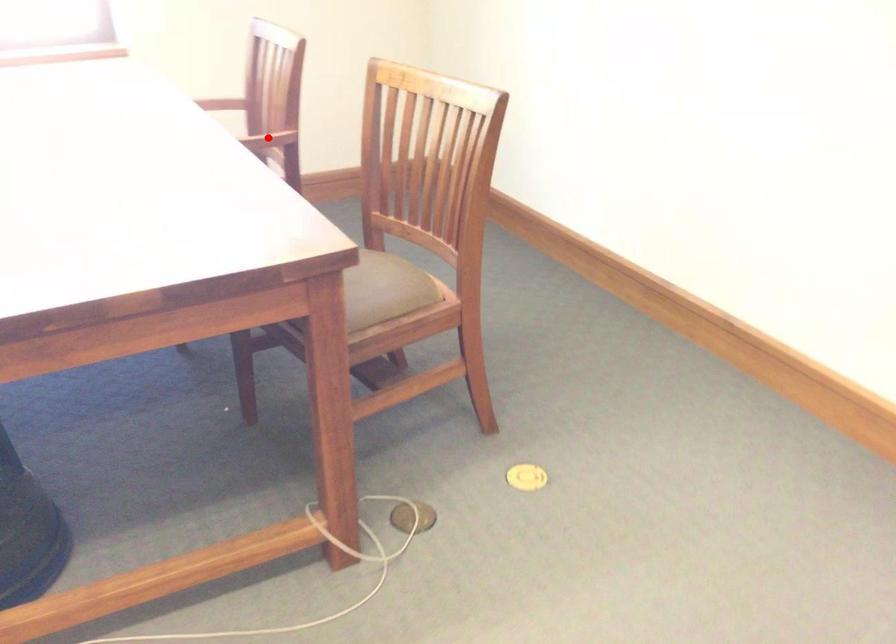
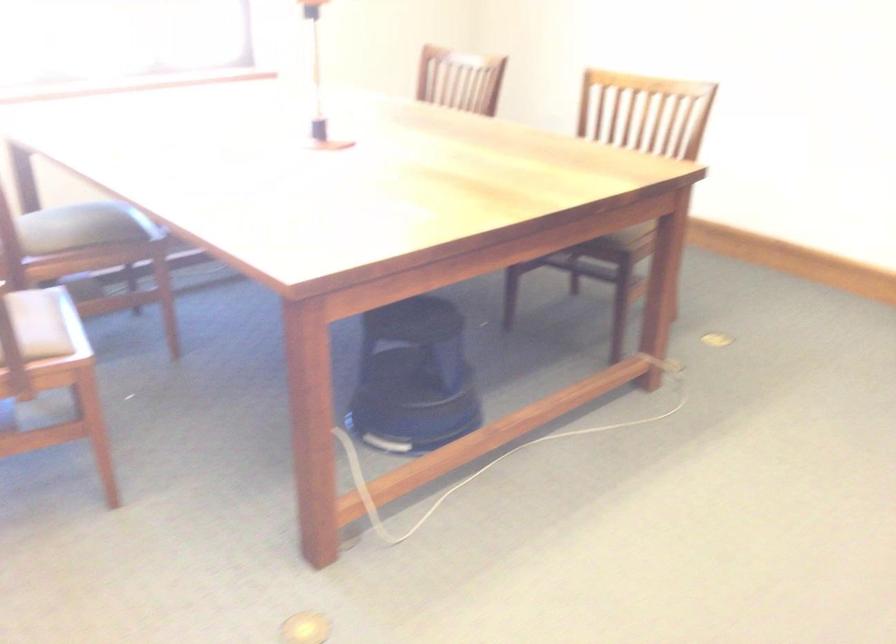
Question: I am providing you with two images of the same scene from different viewpoints. A red point is marked on the first image. Is the red point's position out of view in image 2?

Choices:
 (A) Yes
 (B) No

Answer: (A)